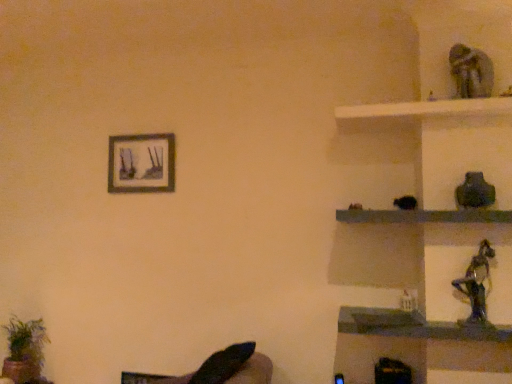
Question: Considering the relative positions of green leafy plant at lower left and shiny metallic figurine at right in the image provided, is green leafy plant at lower left to the left of shiny metallic figurine at right from the viewer's perspective?

Choices:
 (A) no
 (B) yes

Answer: (B)

Question: Is green leafy plant at lower left behind shiny metallic figurine at right?

Choices:
 (A) no
 (B) yes

Answer: (B)

Question: Is green leafy plant at lower left smaller than shiny metallic figurine at right?

Choices:
 (A) no
 (B) yes

Answer: (A)

Question: Is green leafy plant at lower left wider than shiny metallic figurine at right?

Choices:
 (A) yes
 (B) no

Answer: (A)

Question: Is green leafy plant at lower left completely or partially outside of shiny metallic figurine at right?

Choices:
 (A) yes
 (B) no

Answer: (A)

Question: From the image's perspective, is green leafy plant at lower left positioned above or below black glossy statue at upper right, arranged as the second shelf when ordered from the bottom?

Choices:
 (A) above
 (B) below

Answer: (B)

Question: Choose the correct answer: Is green leafy plant at lower left inside black glossy statue at upper right, arranged as the second shelf when ordered from the bottom, or outside it?

Choices:
 (A) inside
 (B) outside

Answer: (B)

Question: Would you say green leafy plant at lower left is to the left or to the right of black glossy statue at upper right, arranged as the second shelf when ordered from the bottom, in the picture?

Choices:
 (A) right
 (B) left

Answer: (B)

Question: Is green leafy plant at lower left bigger or smaller than black glossy statue at upper right, arranged as the second shelf when ordered from the bottom?

Choices:
 (A) small
 (B) big

Answer: (A)

Question: From a real-world perspective, is black leather swivel chair at lower left physically located above or below black glossy statue at lower right, placed as the first shelf when sorted from bottom to top?

Choices:
 (A) below
 (B) above

Answer: (A)

Question: Based on their positions, is black leather swivel chair at lower left located to the left or right of black glossy statue at lower right, the 2th shelf from the top?

Choices:
 (A) right
 (B) left

Answer: (B)

Question: Is black leather swivel chair at lower left spatially inside black glossy statue at lower right, the 2th shelf from the top, or outside of it?

Choices:
 (A) inside
 (B) outside

Answer: (B)

Question: In terms of size, does black leather swivel chair at lower left appear bigger or smaller than black glossy statue at lower right, the 2th shelf from the top?

Choices:
 (A) small
 (B) big

Answer: (B)

Question: From a real-world perspective, is black leather swivel chair at lower left physically located above or below green leafy plant at lower left?

Choices:
 (A) above
 (B) below

Answer: (B)

Question: Considering the positions of point (165, 382) and point (22, 324), is point (165, 382) closer or farther from the camera than point (22, 324)?

Choices:
 (A) closer
 (B) farther

Answer: (A)